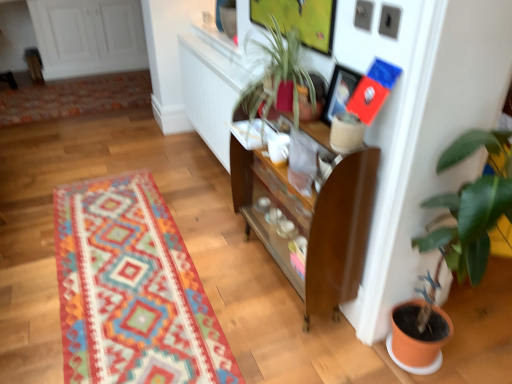
Locate an element on the screen. The image size is (512, 384). vacant space to the right of multicolored woven rug at center, which appears as the second mat when viewed from the back is located at coordinates (245, 279).